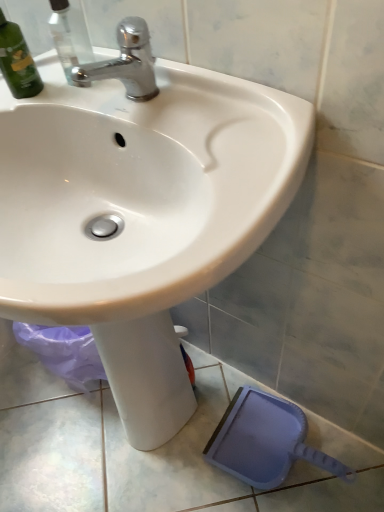
This screenshot has width=384, height=512. I want to click on free location to the right of chrome metallic faucet at upper center, so click(226, 106).